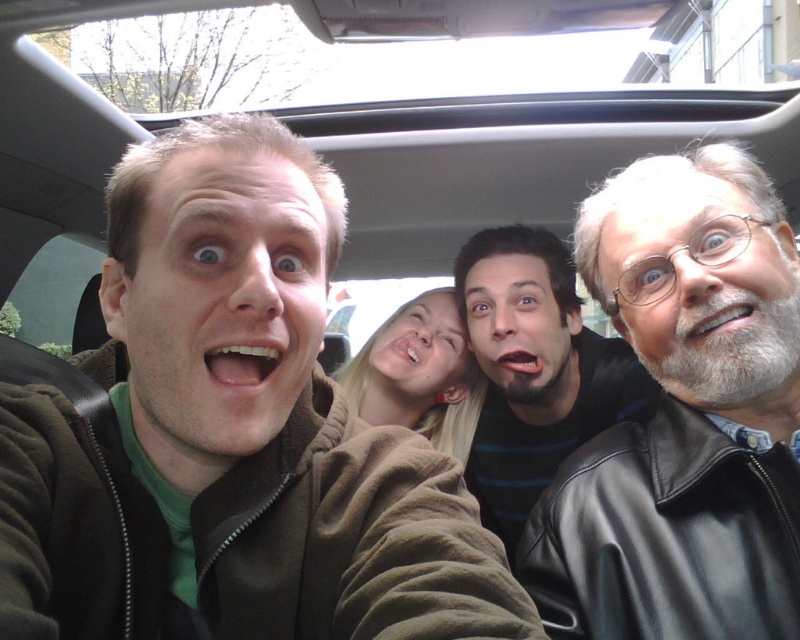
Question: In this image, where is black leather jacket at right located relative to dark blue striped shirt at center?

Choices:
 (A) left
 (B) right

Answer: (A)

Question: Can you confirm if black leather jacket at right is positioned below dark blue striped shirt at center?

Choices:
 (A) no
 (B) yes

Answer: (A)

Question: Which of the following is the closest to the observer?

Choices:
 (A) (484, 412)
 (B) (576, 632)

Answer: (B)

Question: Which point appears closest to the camera in this image?

Choices:
 (A) (692, 355)
 (B) (536, 358)

Answer: (A)

Question: Is black leather jacket at right below dark blue striped shirt at center?

Choices:
 (A) no
 (B) yes

Answer: (A)